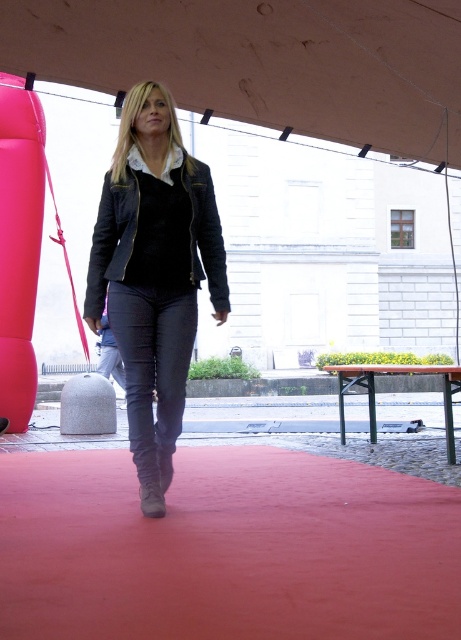
Question: Is brown fabric canopy at upper center to the left of denim jeans at center from the viewer's perspective?

Choices:
 (A) yes
 (B) no

Answer: (B)

Question: Estimate the real-world distances between objects in this image. Which object is closer to the denim jeans at center?

Choices:
 (A) dark gray denim jeans at center
 (B) red carpet at center
 (C) velvet black jacket at center
 (D) velvet-like black jacket at center

Answer: (B)

Question: Can you confirm if brown fabric canopy at upper center is wider than velvet-like black jacket at center?

Choices:
 (A) yes
 (B) no

Answer: (A)

Question: Which of the following is the farthest from the observer?

Choices:
 (A) (137, 349)
 (B) (190, 596)
 (C) (102, 349)
 (D) (439, 150)

Answer: (C)

Question: Where is brown fabric canopy at upper center located in relation to velvet black jacket at center in the image?

Choices:
 (A) above
 (B) below

Answer: (A)

Question: Considering the real-world distances, which object is closest to the brown fabric canopy at upper center?

Choices:
 (A) velvet black jacket at center
 (B) red carpet at center
 (C) dark gray denim jeans at center

Answer: (A)